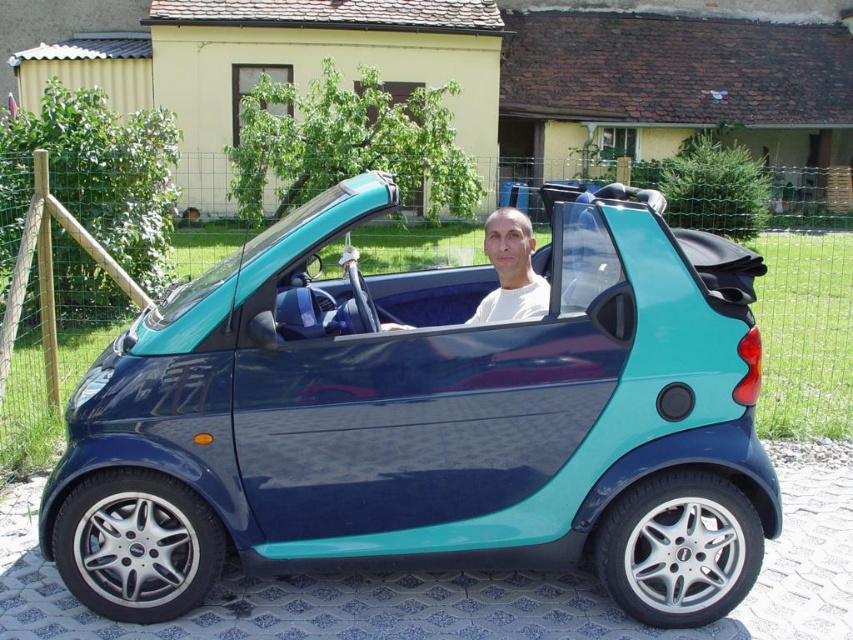
Question: Does teal glossy car at center have a lesser width compared to white matte shirt at center?

Choices:
 (A) yes
 (B) no

Answer: (B)

Question: Which object is closer to the camera taking this photo?

Choices:
 (A) teal glossy car at center
 (B) white matte shirt at center

Answer: (A)

Question: Which point is farther from the camera taking this photo?

Choices:
 (A) tap(549, 288)
 (B) tap(317, 456)

Answer: (A)

Question: Does teal glossy car at center appear on the left side of white matte shirt at center?

Choices:
 (A) yes
 (B) no

Answer: (A)

Question: Among these points, which one is nearest to the camera?

Choices:
 (A) (93, 492)
 (B) (523, 218)

Answer: (A)

Question: Does teal glossy car at center have a greater width compared to white matte shirt at center?

Choices:
 (A) no
 (B) yes

Answer: (B)